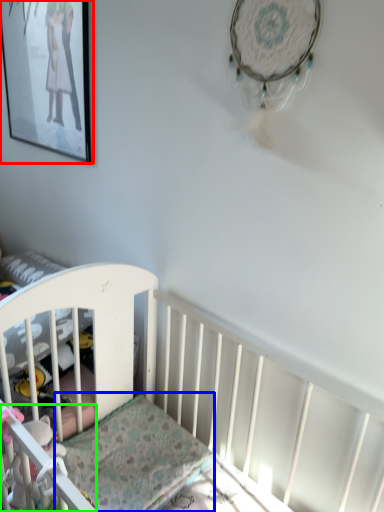
Question: Based on their relative distances, which object is farther from picture frame (highlighted by a red box)? Choose from mattress (highlighted by a blue box) and toy (highlighted by a green box).

Choices:
 (A) mattress
 (B) toy

Answer: (B)